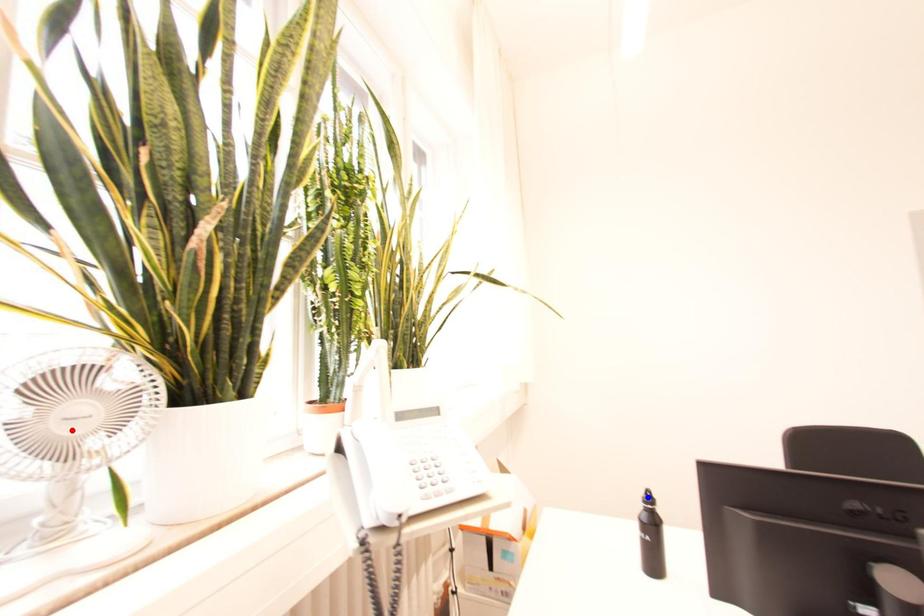
Question: Which of the two points in the image is closer to the camera?

Choices:
 (A) Blue point is closer.
 (B) Red point is closer.

Answer: (B)